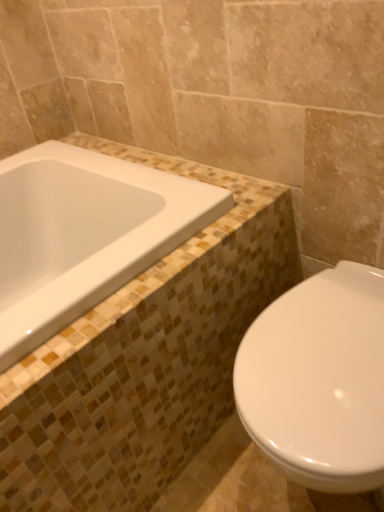
Question: Are white glossy bathtub at upper left and white glossy toilet at lower right far apart?

Choices:
 (A) yes
 (B) no

Answer: (B)

Question: Is white glossy bathtub at upper left wider than white glossy toilet at lower right?

Choices:
 (A) yes
 (B) no

Answer: (A)

Question: Does white glossy bathtub at upper left have a lesser width compared to white glossy toilet at lower right?

Choices:
 (A) yes
 (B) no

Answer: (B)

Question: Does white glossy bathtub at upper left have a smaller size compared to white glossy toilet at lower right?

Choices:
 (A) yes
 (B) no

Answer: (A)

Question: Is white glossy toilet at lower right completely or partially inside white glossy bathtub at upper left?

Choices:
 (A) yes
 (B) no

Answer: (B)

Question: Considering the relative positions of white glossy bathtub at upper left and white glossy toilet at lower right in the image provided, is white glossy bathtub at upper left in front of white glossy toilet at lower right?

Choices:
 (A) yes
 (B) no

Answer: (B)

Question: From the image's perspective, does white glossy toilet at lower right appear higher than white glossy bathtub at upper left?

Choices:
 (A) no
 (B) yes

Answer: (A)

Question: Considering the relative positions of white glossy toilet at lower right and white glossy bathtub at upper left in the image provided, is white glossy toilet at lower right to the right of white glossy bathtub at upper left from the viewer's perspective?

Choices:
 (A) yes
 (B) no

Answer: (A)

Question: From a real-world perspective, is white glossy toilet at lower right physically below white glossy bathtub at upper left?

Choices:
 (A) no
 (B) yes

Answer: (B)

Question: Is white glossy toilet at lower right wider than white glossy bathtub at upper left?

Choices:
 (A) no
 (B) yes

Answer: (A)

Question: Is white glossy toilet at lower right closer to the viewer compared to white glossy bathtub at upper left?

Choices:
 (A) yes
 (B) no

Answer: (A)

Question: Is white glossy toilet at lower right smaller than white glossy bathtub at upper left?

Choices:
 (A) yes
 (B) no

Answer: (B)

Question: Which is correct: white glossy bathtub at upper left is inside white glossy toilet at lower right, or outside of it?

Choices:
 (A) outside
 (B) inside

Answer: (A)